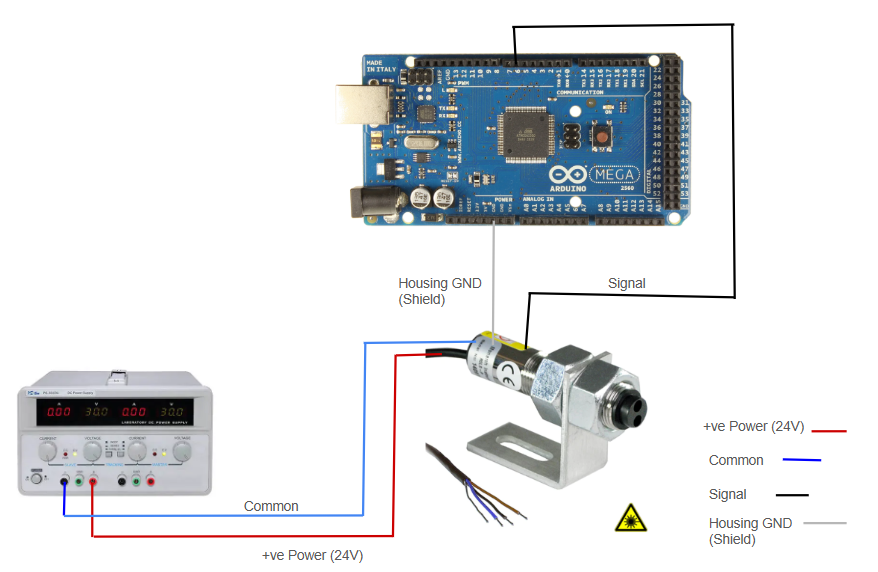
Locate an element on the screen. The width and height of the screenshot is (878, 572). knob is located at coordinates (47, 452), (95, 452), (138, 456), (183, 452).